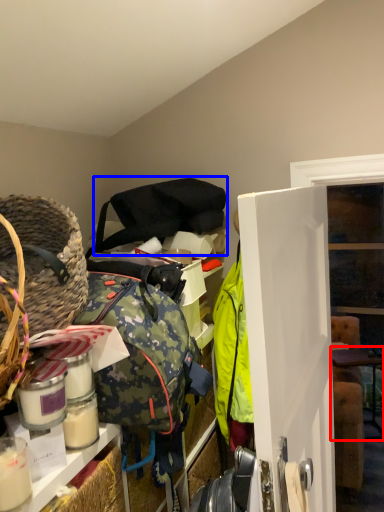
Question: Which of the following is the farthest to the observer, table (highlighted by a red box) or shoulder bag (highlighted by a blue box)?

Choices:
 (A) table
 (B) shoulder bag

Answer: (A)